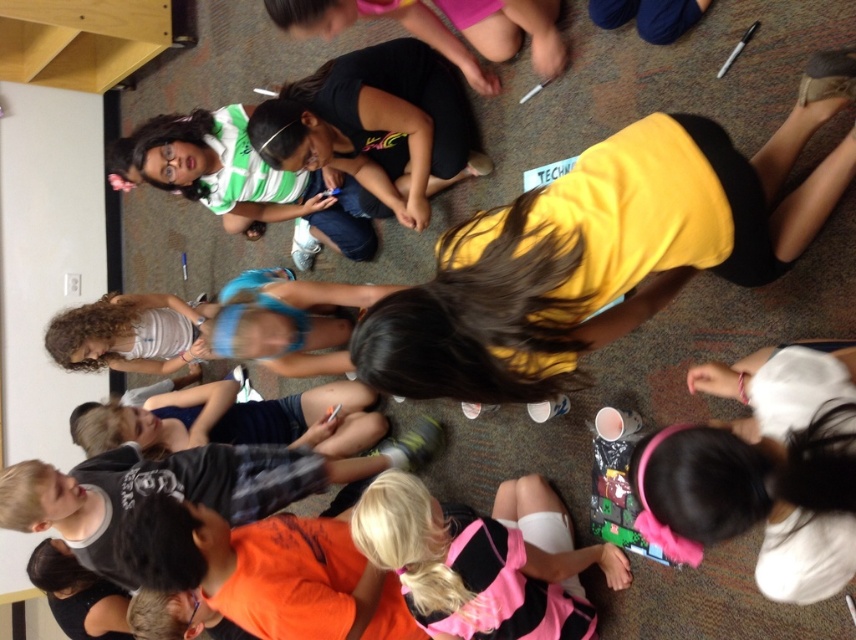
Question: Can you confirm if orange matte shirt at center is wider than pink fabric at upper center?

Choices:
 (A) yes
 (B) no

Answer: (B)

Question: Is yellow matte shirt at center to the left of orange matte shirt at center from the viewer's perspective?

Choices:
 (A) yes
 (B) no

Answer: (B)

Question: Estimate the real-world distances between objects in this image. Which object is farther from the pink fabric at upper center?

Choices:
 (A) orange cotton shirt at lower center
 (B) orange matte shirt at center

Answer: (B)

Question: Where is yellow matte shirt at center located in relation to orange cotton shirt at lower center in the image?

Choices:
 (A) above
 (B) below

Answer: (A)

Question: Which point is closer to the camera?

Choices:
 (A) (538, 13)
 (B) (507, 246)

Answer: (B)

Question: Among these points, which one is nearest to the camera?

Choices:
 (A) (544, 38)
 (B) (601, 296)
 (C) (551, 529)

Answer: (B)